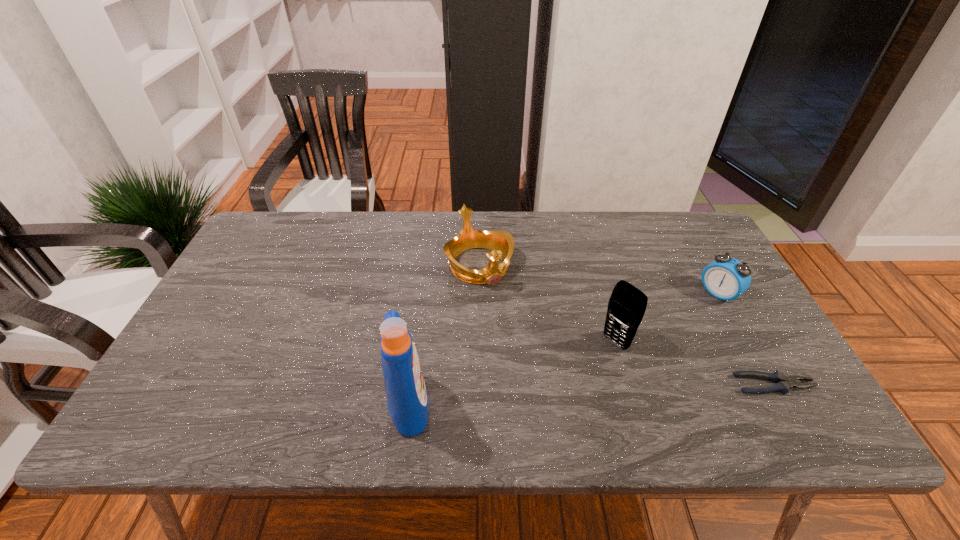
Find the location of a particular element. free space on the desktop that is between the leftmost object and the shortest object and is positioned at the front emblem of the tiara is located at coordinates (559, 396).

Identify the location of vacant space on the desktop that is between the detergent and the shortest object and is positioned on the face of the alarm clock. This screenshot has width=960, height=540. click(x=586, y=394).

Identify the location of free space on the desktop that is between the detergent and the pliers and is positioned on the screen of the second tallest object. The image size is (960, 540). (545, 396).